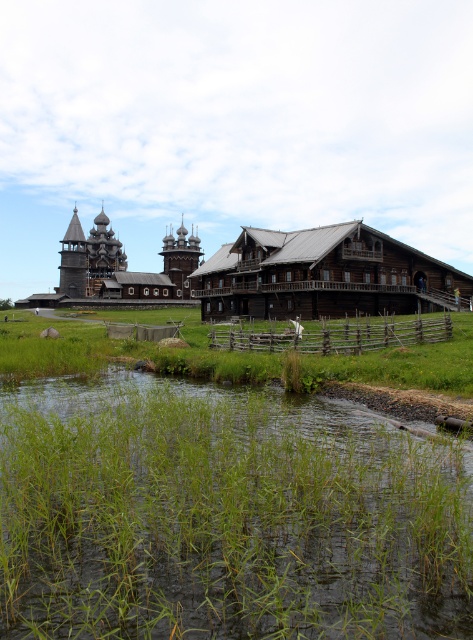
Question: Which point is farther to the camera?

Choices:
 (A) brown wooden fence at center
 (B) green grass at lower center

Answer: (A)

Question: Which of the following is the farthest from the observer?

Choices:
 (A) green grass at lower center
 (B) brown wooden fence at center

Answer: (B)

Question: Can you confirm if green grass at lower center is smaller than brown wooden fence at center?

Choices:
 (A) yes
 (B) no

Answer: (B)

Question: Considering the relative positions of green grass at lower center and brown wooden fence at center in the image provided, where is green grass at lower center located with respect to brown wooden fence at center?

Choices:
 (A) right
 (B) left

Answer: (B)

Question: Is green grass at lower center wider than brown wooden fence at center?

Choices:
 (A) no
 (B) yes

Answer: (B)

Question: Which point is closer to the camera?

Choices:
 (A) 344,348
 (B) 152,586

Answer: (B)